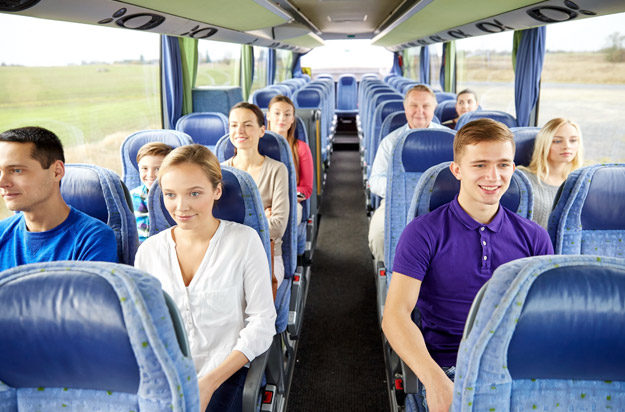
I want to click on blue curtain, so click(x=530, y=72), click(x=422, y=64), click(x=442, y=71), click(x=398, y=66), click(x=299, y=65), click(x=272, y=64), click(x=252, y=71), click(x=178, y=81).